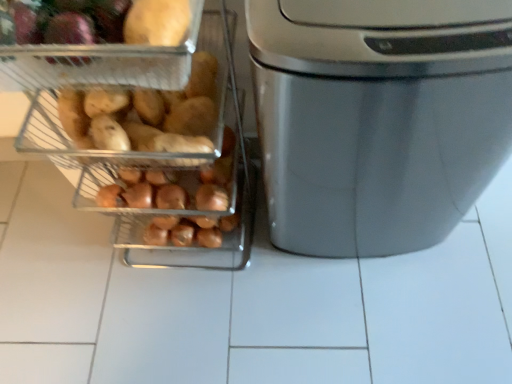
Question: Would you say satin silver trash can at right is to the left or to the right of metallic silver trash can at right in the picture?

Choices:
 (A) left
 (B) right

Answer: (B)

Question: Relative to metallic silver trash can at right, is satin silver trash can at right in front or behind?

Choices:
 (A) front
 (B) behind

Answer: (B)

Question: Which of these objects is positioned closest to the matte yellow potato at upper left?

Choices:
 (A) matte brown sweet potato at left
 (B) metallic silver trash can at right
 (C) satin silver trash can at right

Answer: (A)

Question: Which object is the closest to the satin silver trash can at right?

Choices:
 (A) metallic silver trash can at right
 (B) matte yellow potato at upper left
 (C) matte brown sweet potato at left

Answer: (A)